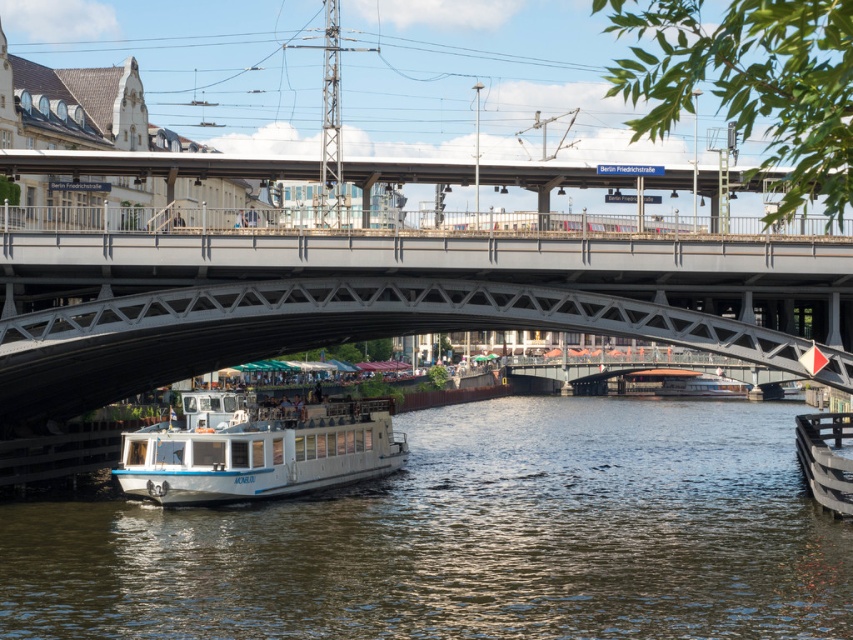
You are a photographer planning to take a wide shot of the canal and the bridge. You want to ensure that both the white glossy water at center and the white glossy boat at lower center are clearly visible in the frame. Given their sizes, which object will occupy more of the photo composition?

The white glossy water at center is larger in size than the white glossy boat at lower center, so it will occupy more of the photo composition.

Consider the image. You are standing on the wooden pier where the white boat with blue accents is docked. You see a point marked at coordinates [469,538]. Where is this point located in relation to the white boat with blue accents?

The point marked at coordinates [469,538] is located on the white glossy water at center, which is away from the white boat with blue accents docked on the left side of the canal.

You are standing at the point marked by coordinates point (374, 298). Looking around, you see the metallic gray bridge at center. Which direction should you walk to reach the white boat with blue accents docked on the left side of the canal?

The white boat with blue accents is located on the left side of the canal, so you should walk towards the left side of the canal from the point marked by coordinates point (374, 298) to reach it.